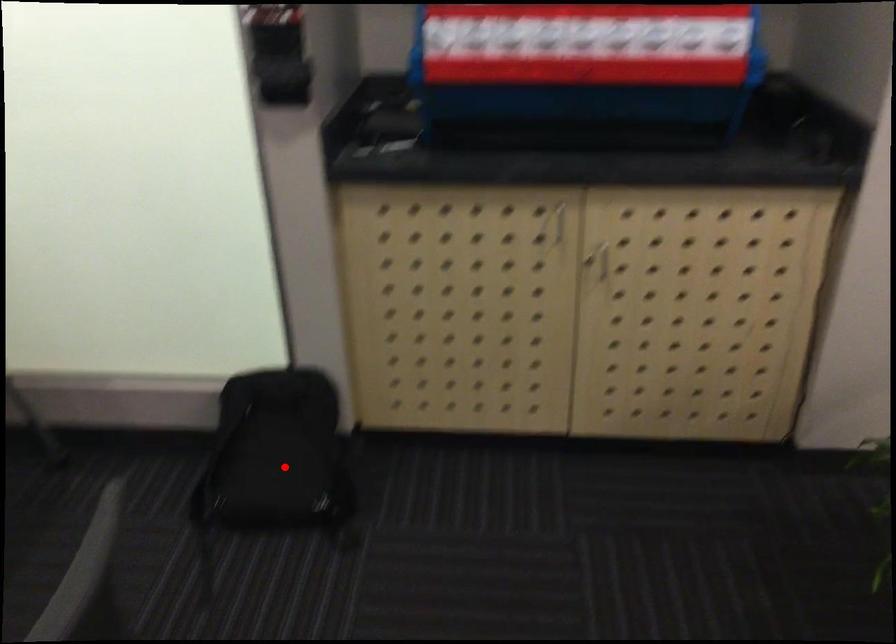
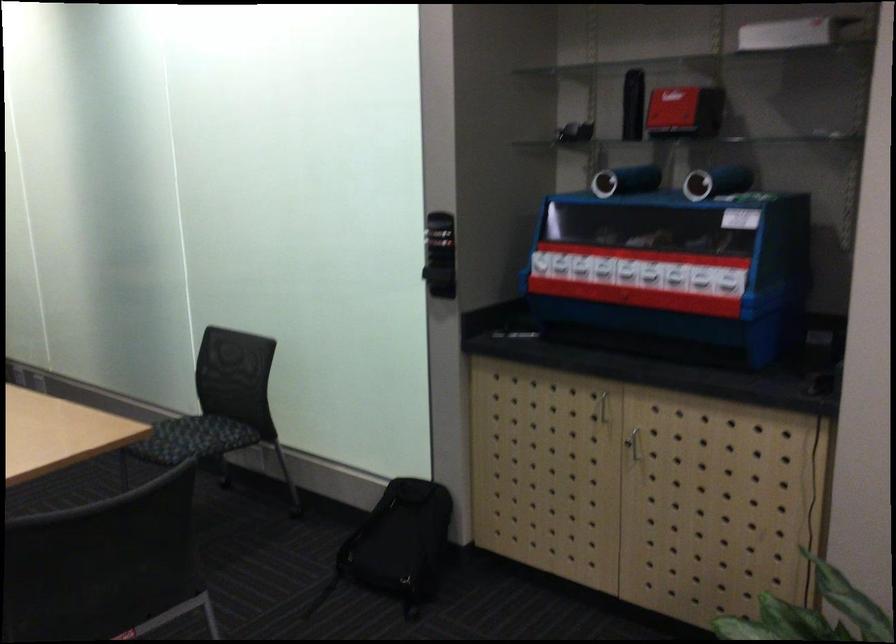
Question: I am providing you with two images of the same scene from different viewpoints. Given a red point in image1, look at the same physical point in image2. Is it:

Choices:
 (A) Closer to the viewpoint
 (B) Farther from the viewpoint

Answer: (B)